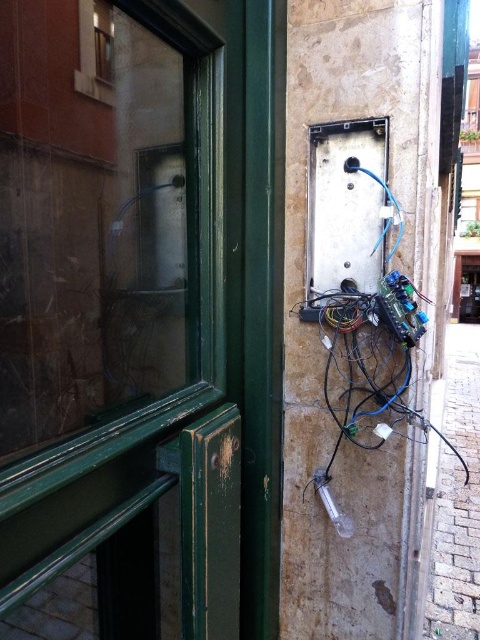
Describe the element at coordinates (122, 310) in the screenshot. The width and height of the screenshot is (480, 640). I see `transparent glass door at left` at that location.

Does transparent glass door at left appear over metallic gray electrical box at center?

No.

Is point (81, 26) farther from camera compared to point (305, 273)?

No, it is not.

This screenshot has height=640, width=480. Identify the location of transparent glass door at left. (122, 310).

Who is positioned more to the right, transparent glass door at left or black plastic wires at lower right?

From the viewer's perspective, black plastic wires at lower right appears more on the right side.

Does transparent glass door at left come in front of black plastic wires at lower right?

Yes, it is.

Between point (57, 141) and point (468, 500), which one is positioned in front?

Positioned in front is point (57, 141).

At what (x,y) coordinates should I click in order to perform the action: click on transparent glass door at left. Please return your answer as a coordinate pair (x, y). Looking at the image, I should click on (122, 310).

Is the position of transparent glass door at left less distant than that of clear glass window at upper left?

Yes, transparent glass door at left is closer to the viewer.

Who is higher up, transparent glass door at left or clear glass window at upper left?

Positioned higher is clear glass window at upper left.

Between point (218, 264) and point (101, 35), which one is positioned in front?

Positioned in front is point (101, 35).

I want to click on transparent glass door at left, so click(122, 310).